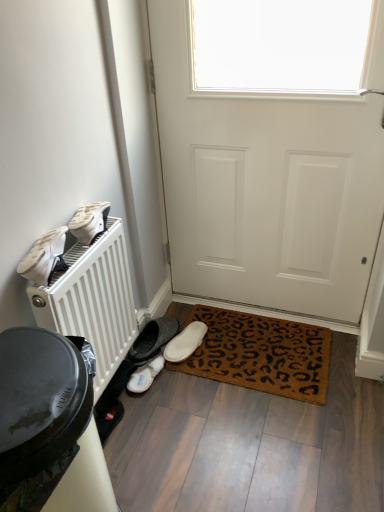
Question: Is white fluffy slippers at lower center, which appears as the first footwear when ordered from the bottom, to the right of white matte shoe at left, which appears as the second footwear when viewed from the front, from the viewer's perspective?

Choices:
 (A) yes
 (B) no

Answer: (A)

Question: Does white fluffy slippers at lower center, which appears as the first footwear when ordered from the bottom, turn towards white matte shoe at left, which is counted as the 3th footwear, starting from the back?

Choices:
 (A) no
 (B) yes

Answer: (A)

Question: From the image's perspective, would you say white fluffy slippers at lower center, which appears as the first footwear when ordered from the bottom, is positioned over white matte shoe at left, which is the 4th footwear in bottom-to-top order?

Choices:
 (A) no
 (B) yes

Answer: (A)

Question: Does white fluffy slippers at lower center, which appears as the second footwear when viewed from the back, lie behind white matte shoe at left, the 1th footwear from the top?

Choices:
 (A) yes
 (B) no

Answer: (A)

Question: Is the depth of white fluffy slippers at lower center, which appears as the second footwear when viewed from the back, less than that of white matte shoe at left, which appears as the second footwear when viewed from the front?

Choices:
 (A) yes
 (B) no

Answer: (B)

Question: From the image's perspective, does white fluffy slippers at lower center, acting as the fourth footwear starting from the top, appear lower than white matte shoe at left, which appears as the second footwear when viewed from the front?

Choices:
 (A) no
 (B) yes

Answer: (B)

Question: Is white suede shoes at left, which is the 4th footwear from back to front, outside of white matte shoe at left, the 1th footwear from the top?

Choices:
 (A) no
 (B) yes

Answer: (B)

Question: Can you confirm if white suede shoes at left, which is the first footwear from front to back, is bigger than white matte shoe at left, which is the 4th footwear in bottom-to-top order?

Choices:
 (A) yes
 (B) no

Answer: (A)

Question: Is white suede shoes at left, which is the 4th footwear from back to front, at the right side of white matte shoe at left, which appears as the second footwear when viewed from the front?

Choices:
 (A) no
 (B) yes

Answer: (A)

Question: Considering the relative sizes of white suede shoes at left, arranged as the third footwear when ordered from the bottom, and white matte shoe at left, which is counted as the 3th footwear, starting from the back, in the image provided, is white suede shoes at left, arranged as the third footwear when ordered from the bottom, shorter than white matte shoe at left, which is counted as the 3th footwear, starting from the back,?

Choices:
 (A) yes
 (B) no

Answer: (B)

Question: Is white suede shoes at left, arranged as the third footwear when ordered from the bottom, positioned in front of white matte shoe at left, which is counted as the 3th footwear, starting from the back?

Choices:
 (A) yes
 (B) no

Answer: (A)

Question: Is white suede shoes at left, which is the 4th footwear from back to front, far from white matte shoe at left, which is counted as the 3th footwear, starting from the back?

Choices:
 (A) no
 (B) yes

Answer: (A)

Question: Is white matte door at center beside white suede slipper at lower center, acting as the 1th footwear starting from the back?

Choices:
 (A) no
 (B) yes

Answer: (A)